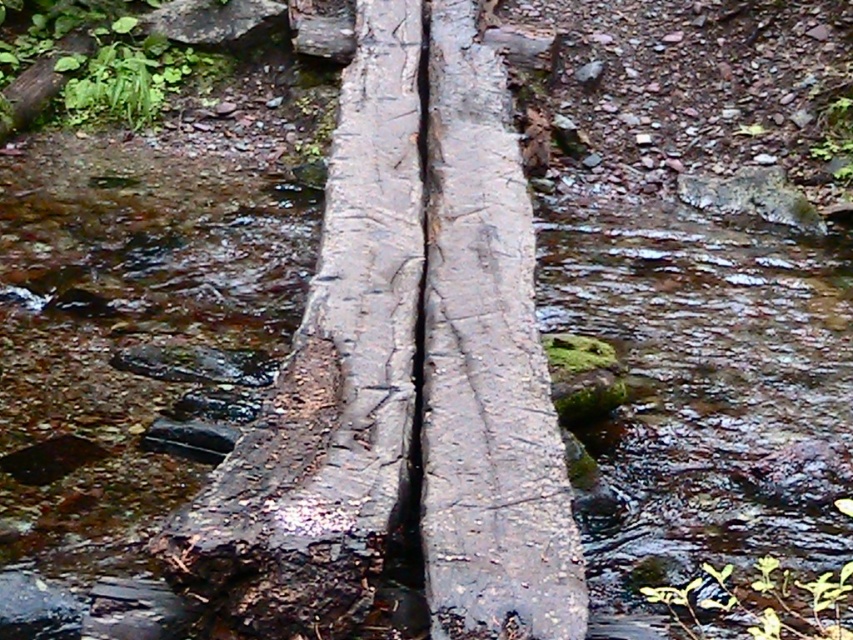
From the picture: Which is below, wet wood log at center or smooth bark log at center?

wet wood log at center is lower down.

Is wet wood log at center taller than smooth bark log at center?

No, wet wood log at center is not taller than smooth bark log at center.

Measure the distance between point (x=619, y=216) and camera.

Point (x=619, y=216) and camera are 5.40 meters apart.

Where is `wet wood log at center`? The image size is (853, 640). wet wood log at center is located at coordinates (131, 371).

What do you see at coordinates (405, 372) in the screenshot? This screenshot has height=640, width=853. I see `rough bark log at center` at bounding box center [405, 372].

Consider the image. Measure the distance between rough bark log at center and smooth bark log at center.

The distance of rough bark log at center from smooth bark log at center is 3.63 inches.

Image resolution: width=853 pixels, height=640 pixels. What do you see at coordinates (405, 372) in the screenshot?
I see `rough bark log at center` at bounding box center [405, 372].

Find the location of a particular element. The height and width of the screenshot is (640, 853). rough bark log at center is located at coordinates (405, 372).

Looking at this image, who is more distant from viewer, (606, 522) or (432, 320)?

The point (606, 522) is more distant.

Between wet wood log at center and rough bark log at center, which one appears on the left side from the viewer's perspective?

wet wood log at center

You are a GUI agent. You are given a task and a screenshot of the screen. Output one action in this format:
    pyautogui.click(x=<x>, y=<y>)
    Task: Click on the wet wood log at center
    The height and width of the screenshot is (640, 853).
    Given the screenshot: What is the action you would take?
    pyautogui.click(x=131, y=371)